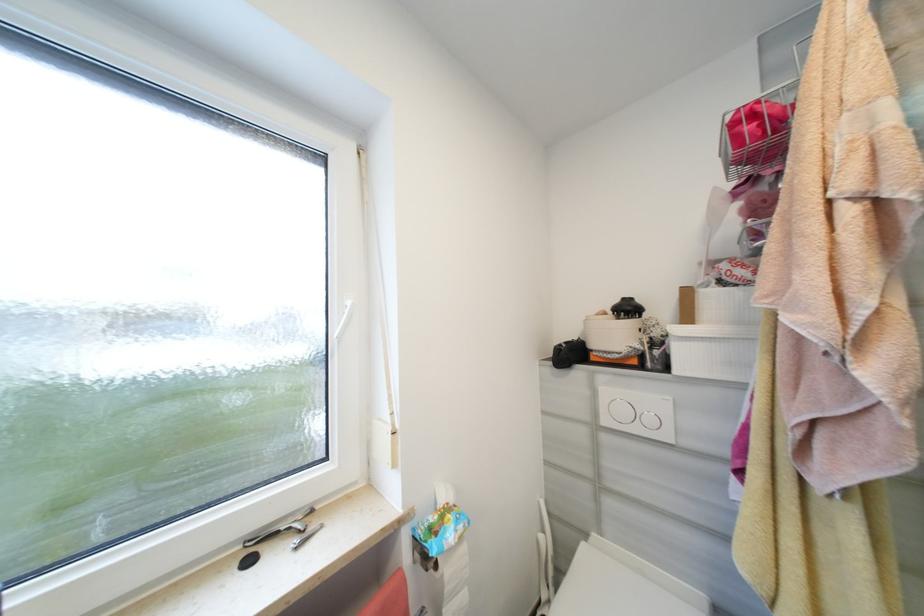
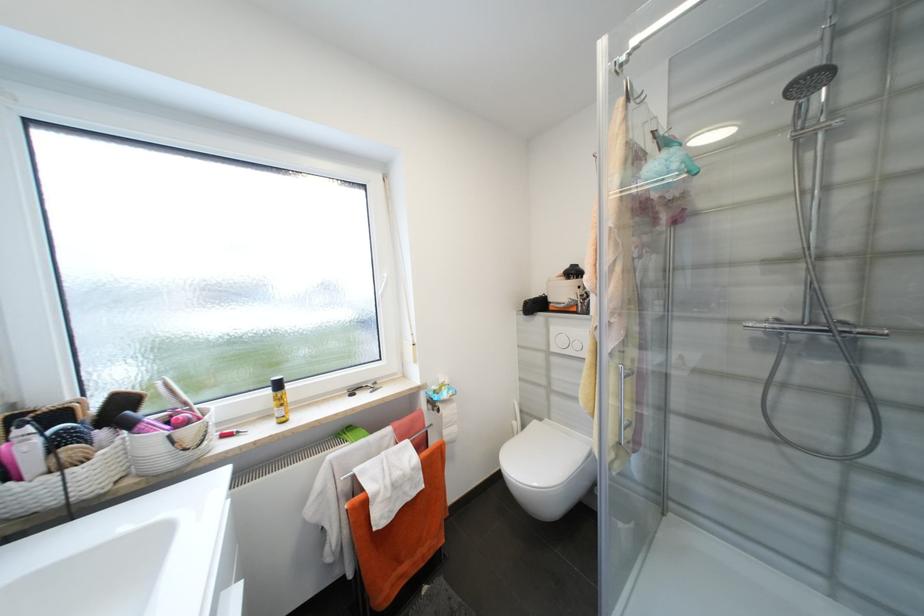
Locate, in the second image, the point that corresponds to (x=442, y=567) in the first image.

(444, 411)